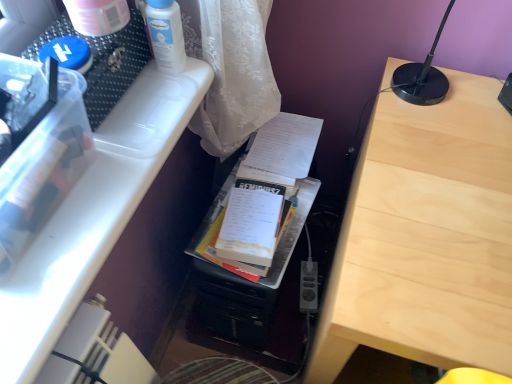
Identify the location of empty space that is ontop of white plastic container at upper left. (109, 152).